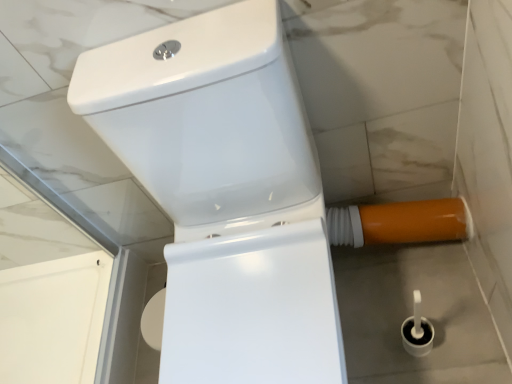
Question: Is point click(x=332, y=221) closer or farther from the camera than point click(x=228, y=248)?

Choices:
 (A) farther
 (B) closer

Answer: (A)

Question: Is orange glossy water pipe at lower right to the left or to the right of white glossy toilet at center in the image?

Choices:
 (A) right
 (B) left

Answer: (A)

Question: From a real-world perspective, is orange glossy water pipe at lower right positioned above or below white glossy toilet at center?

Choices:
 (A) above
 (B) below

Answer: (B)

Question: Is white glossy toilet at center bigger or smaller than orange glossy water pipe at lower right?

Choices:
 (A) big
 (B) small

Answer: (A)

Question: From a real-world perspective, is white glossy toilet at center physically located above or below orange glossy water pipe at lower right?

Choices:
 (A) below
 (B) above

Answer: (B)

Question: In terms of height, does white glossy toilet at center look taller or shorter compared to orange glossy water pipe at lower right?

Choices:
 (A) short
 (B) tall

Answer: (B)

Question: Considering their positions, is white glossy toilet at center located in front of or behind orange glossy water pipe at lower right?

Choices:
 (A) front
 (B) behind

Answer: (A)